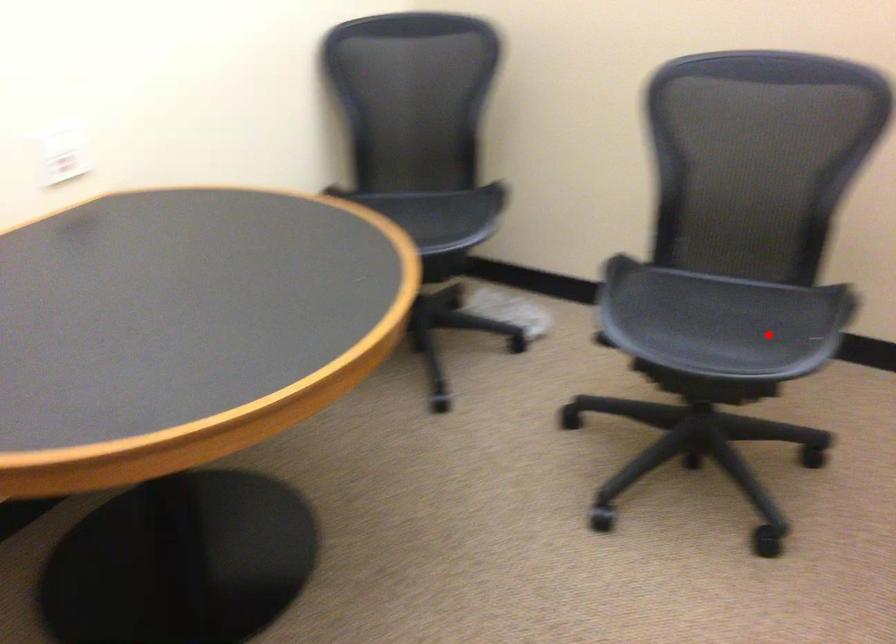
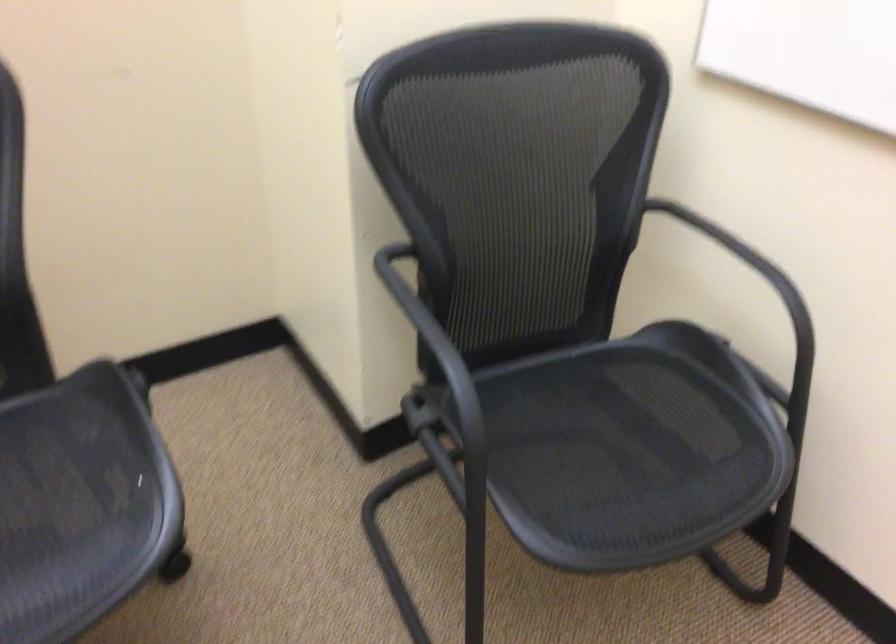
Question: I am providing you with two images of the same scene from different viewpoints. A red point is shown in image1. For the corresponding object point in image2, is it positioned nearer or farther from the camera?

Choices:
 (A) Nearer
 (B) Farther

Answer: (A)